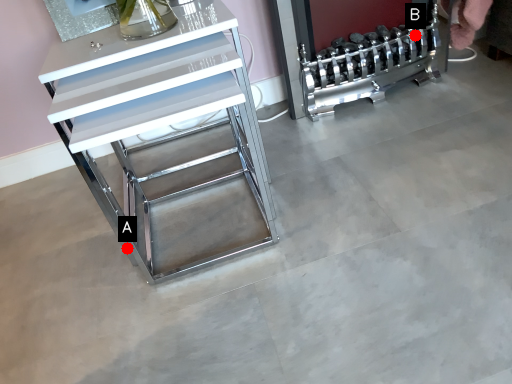
Question: Two points are circled on the image, labeled by A and B beside each circle. Which of the following is the farthest from the observer?

Choices:
 (A) A is further
 (B) B is further

Answer: (B)